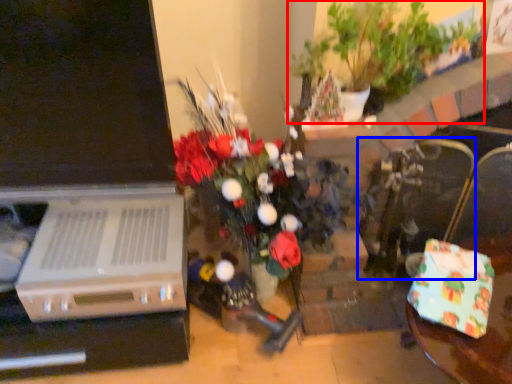
Question: Which of the following is the farthest to the observer, houseplant (highlighted by a red box) or armchair (highlighted by a blue box)?

Choices:
 (A) houseplant
 (B) armchair

Answer: (B)